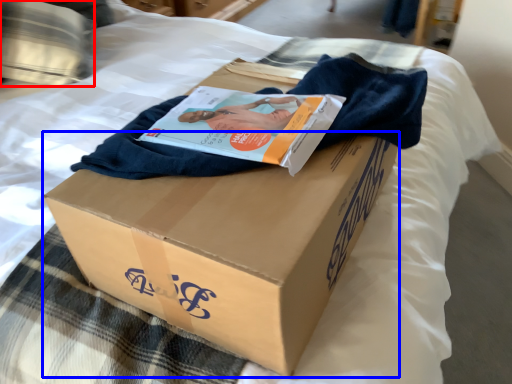
Question: Which of the following is the farthest to the observer, pillow (highlighted by a red box) or cardboard box (highlighted by a blue box)?

Choices:
 (A) pillow
 (B) cardboard box

Answer: (A)